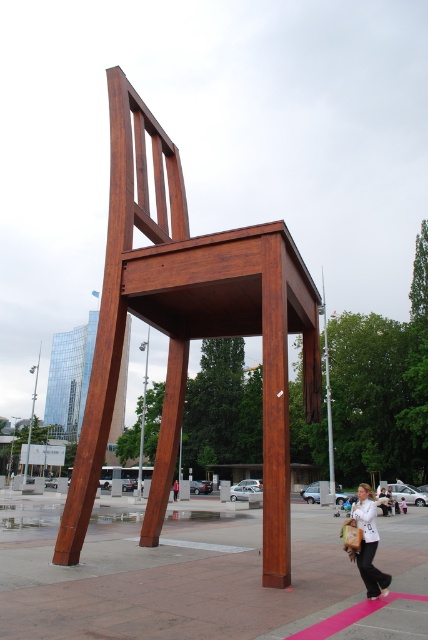
You are standing in the plaza and want to take a photo of the wooden chair at center. Where should you position yourself to capture the chair in the frame?

To capture the wooden chair at center in the frame, position yourself at the center of the plaza since the wooden chair at center is located at point (190, 324), which is near the center of the scene.

You are an artist planning to paint the scene of the chair sculpture in the plaza. You notice two items at the base of the sculpture. Which object, the white cotton shirt at lower right or the white fabric bag at lower center, should you depict as bigger to accurately represent their sizes?

The white cotton shirt at lower right is larger in size than the white fabric bag at lower center, so you should depict the white cotton shirt at lower right as bigger.

Consider the image. You are a delivery person who needs to place a white fabric bag at lower center on the wooden chair at center. Can you place the bag on the chair without needing to climb onto the chair?

The wooden chair at center is much taller than the white fabric bag at lower center, so you would need to climb onto the chair to place the bag on it.